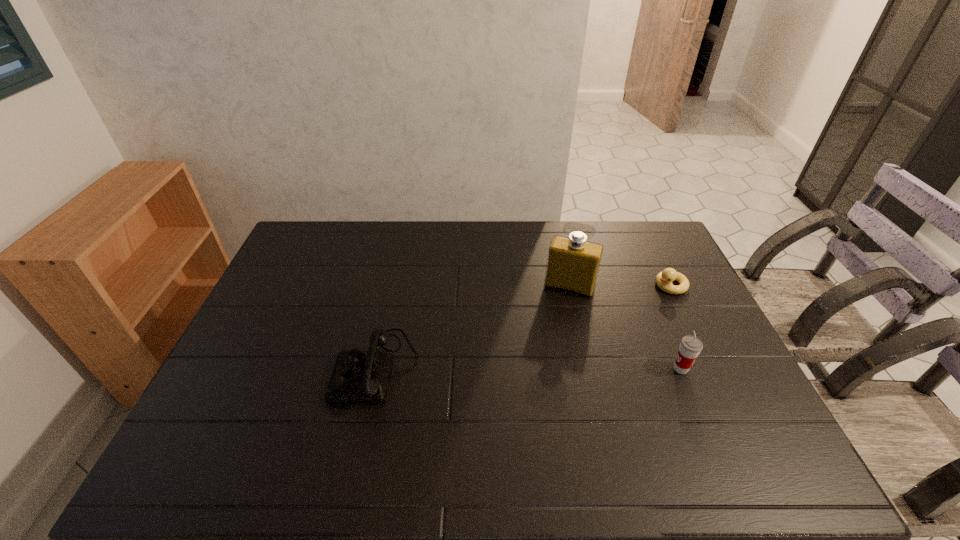
Where is `telephone`? telephone is located at coordinates (359, 377).

In order to click on the leftmost object in this screenshot , I will do `click(359, 377)`.

The width and height of the screenshot is (960, 540). Find the location of `cup`. cup is located at coordinates (690, 347).

Find the location of a particular element. This screenshot has width=960, height=540. the tallest object is located at coordinates (573, 263).

Find the location of `perfume`. perfume is located at coordinates (573, 263).

Locate an element on the screen. This screenshot has width=960, height=540. duckling is located at coordinates (664, 279).

The image size is (960, 540). What are the coordinates of `free space located on the front face of the second shortest object` in the screenshot? It's located at (285, 368).

At what (x,y) coordinates should I click in order to perform the action: click on vacant space located 0.260m on the front face of the second shortest object. Please return your answer as a coordinate pair (x, y). Looking at the image, I should click on (241, 368).

Identify the location of vacant area situated 0.190m on the front face of the second shortest object. (266, 368).

Locate an element on the screen. vacant position located 0.180m on the side of the cup with the logo is located at coordinates (605, 369).